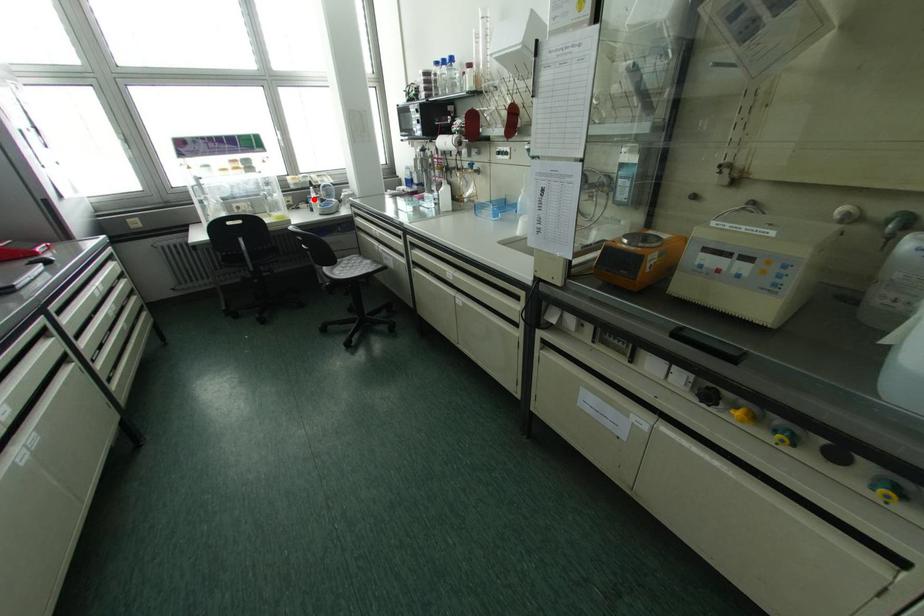
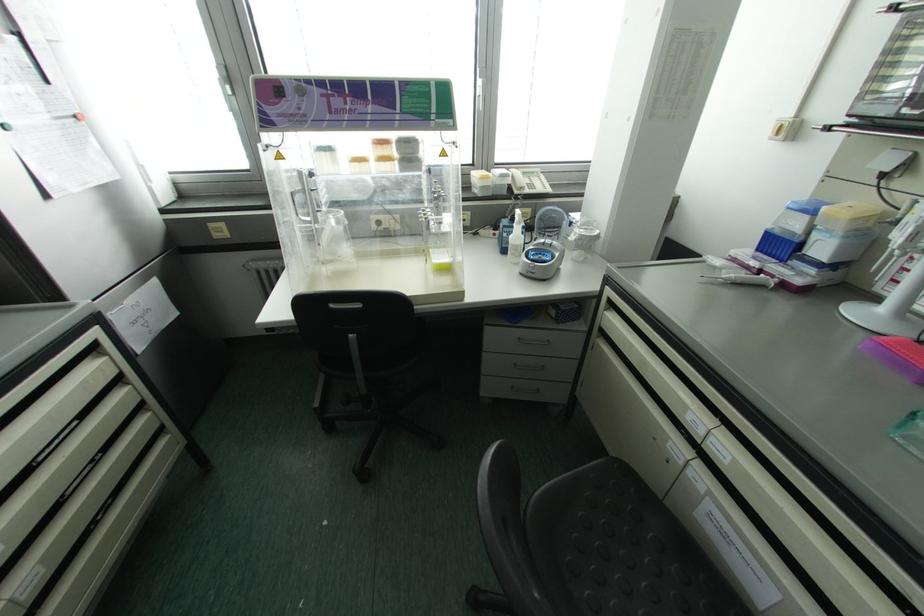
Locate, in the second image, the point that corresponds to the highlighted location in the first image.

(516, 235)